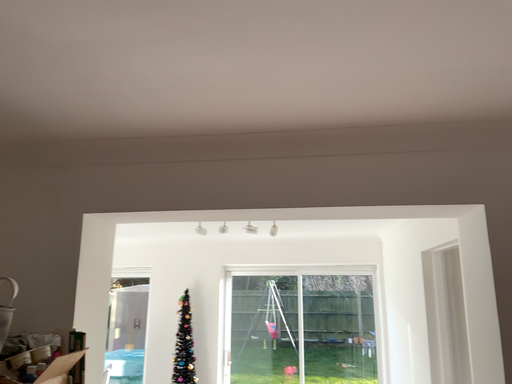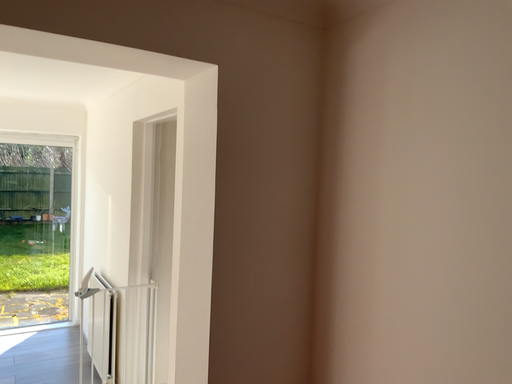
Question: Which way did the camera rotate in the video?

Choices:
 (A) rotated right
 (B) rotated left

Answer: (A)